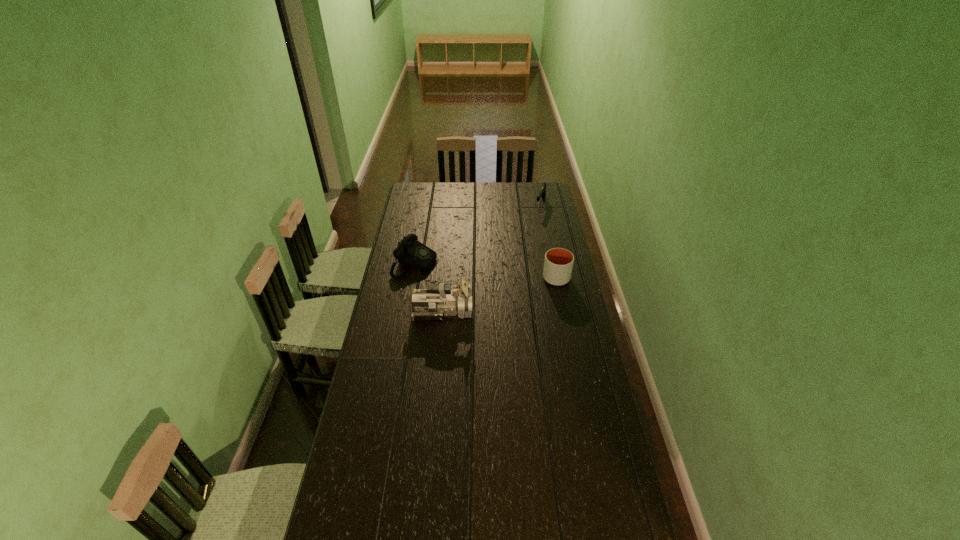
At what (x,y) coordinates should I click in order to perform the action: click on vacant area that lies between the farthest object and the telephone. Please return your answer as a coordinate pair (x, y). Looking at the image, I should click on (478, 234).

Point out which object is positioned as the second nearest to the farthest object. Please provide its 2D coordinates. Your answer should be formatted as a tuple, i.e. [(x, y)], where the tuple contains the x and y coordinates of a point satisfying the conditions above.

[(410, 252)]

The image size is (960, 540). What are the coordinates of `object that is the third closest to the cup` in the screenshot? It's located at (410, 252).

Locate an element on the screen. vacant space that satisfies the following two spatial constraints: 1. on the front side of the telephone; 2. on the front-facing side of the nearest object is located at coordinates (406, 312).